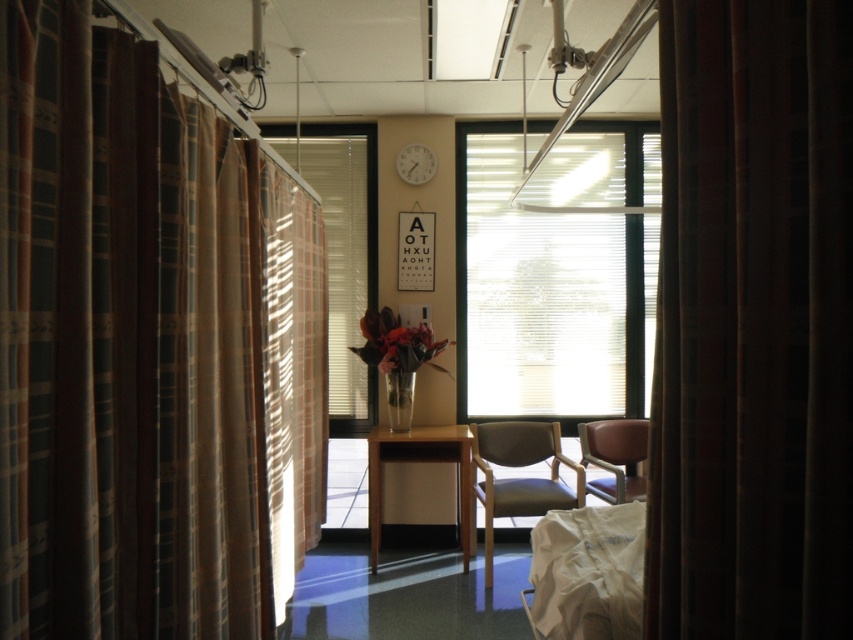
You are a patient in the hospital and need to check the time. You see the beige fabric armchair at center and the white plastic clock at upper center. Which object is bigger in size?

The beige fabric armchair at center is larger in size compared to the white plastic clock at upper center.

You are a patient in a hospital waiting room and want to sit down. You see a translucent fabric window at center and a beige fabric armchair at center. Which object is located to the left of the other?

The translucent fabric window at center is to the left of beige fabric armchair at center.